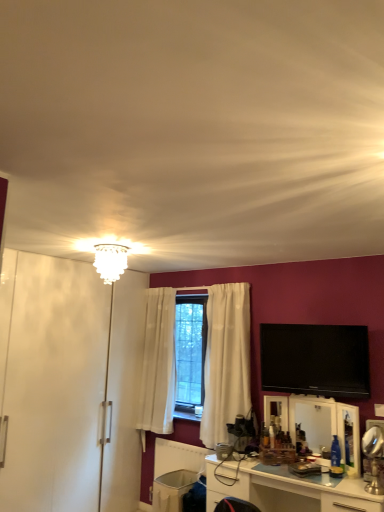
Question: From the image's perspective, is white glossy cabinet at lower center located above or below white glossy armoire at left?

Choices:
 (A) below
 (B) above

Answer: (A)

Question: In terms of height, does white glossy cabinet at lower center look taller or shorter compared to white glossy armoire at left?

Choices:
 (A) short
 (B) tall

Answer: (A)

Question: Which of these objects is positioned farthest from the white plastic trash bin at lower center?

Choices:
 (A) white glossy armoire at left
 (B) white glass chandelier at upper center
 (C) flat screen tv at upper right
 (D) clear glass mirror at center
 (E) white glossy cabinet at lower center

Answer: (B)

Question: Estimate the real-world distances between objects in this image. Which object is closer to the white glossy armoire at left?

Choices:
 (A) white plastic trash bin at lower center
 (B) white glass chandelier at upper center
 (C) white glossy cabinet at lower center
 (D) flat screen tv at upper right
 (E) clear glass mirror at center

Answer: (B)